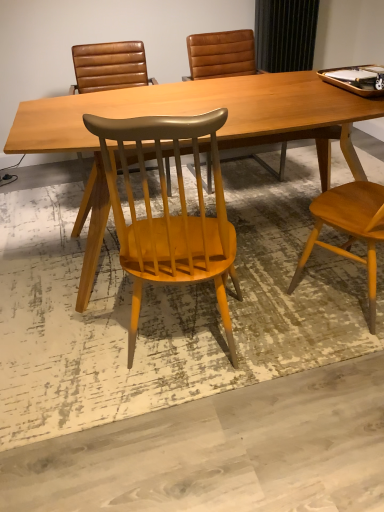
Question: Considering the positions of brown leather chair at upper center, which appears as the second chair when viewed from the front, and matte brown leather chair at center, the 1th chair when ordered from back to front, in the image, is brown leather chair at upper center, which appears as the second chair when viewed from the front, taller or shorter than matte brown leather chair at center, the 1th chair when ordered from back to front,?

Choices:
 (A) tall
 (B) short

Answer: (B)

Question: Considering the positions of point (142, 66) and point (329, 162), is point (142, 66) closer or farther from the camera than point (329, 162)?

Choices:
 (A) farther
 (B) closer

Answer: (A)

Question: Which of these objects is positioned closest to the matte brown leather chair at center, which is the third chair in front-to-back order?

Choices:
 (A) brown leather chair at upper center, which is the second chair from back to front
 (B) matte wood chair at center, marked as the 3th chair in a back-to-front arrangement
 (C) light brown wood desk at center

Answer: (A)

Question: Estimate the real-world distances between objects in this image. Which object is farther from the matte wood chair at center, positioned as the 1th chair in front-to-back order?

Choices:
 (A) brown leather chair at upper center, which appears as the second chair when viewed from the front
 (B) light brown wood desk at center
 (C) matte brown leather chair at center, the 1th chair when ordered from back to front

Answer: (C)